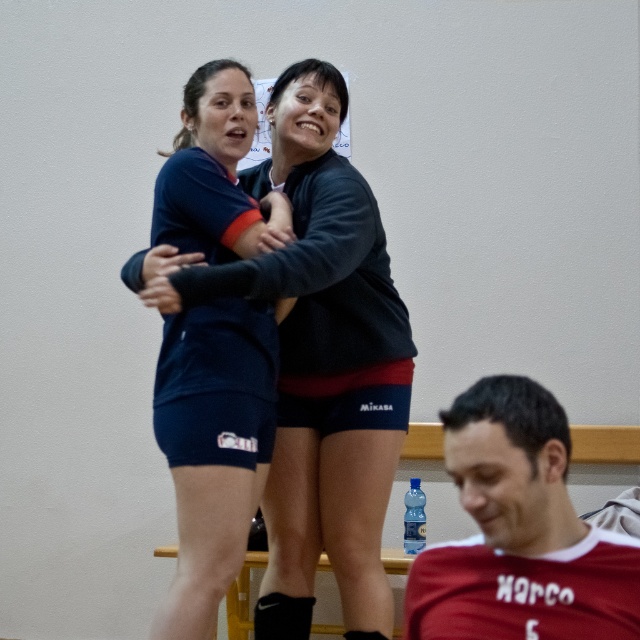
You are a photographer standing at the camera position. You want to take a closeup shot of the dark blue jersey at center. Considering your current distance, is it possible to capture the jersey without moving closer?

The dark blue jersey at center is 2.17 meters away from the camera, so if your camera has a zoom lens capable of focusing at that distance, you can capture a closeup without moving closer.

Consider the image. You are a photographer positioned at the back of the volleyball court. You need to capture a photo of both the dark blue jersey at center and the red jersey at lower right in the same frame. Based on their positions, which jersey should you adjust your camera to focus on first to ensure both are in the shot?

The dark blue jersey at center is to the left of the red jersey at lower right, so you should focus on the dark blue jersey at center first to ensure both are included in the frame.